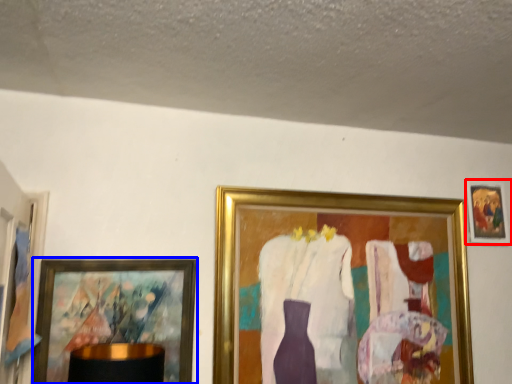
Question: Which of the following is the farthest to the observer, picture frame (highlighted by a red box) or picture frame (highlighted by a blue box)?

Choices:
 (A) picture frame
 (B) picture frame

Answer: (A)